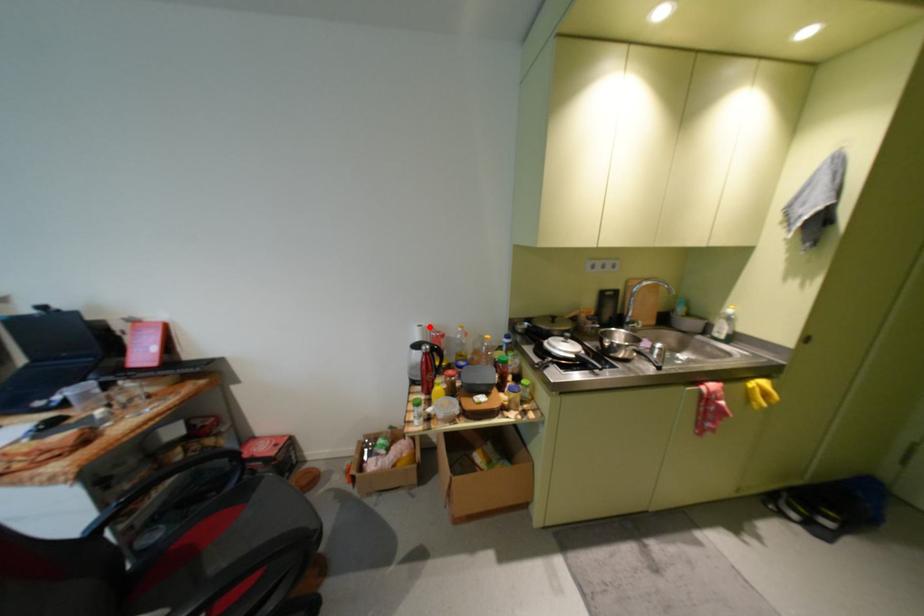
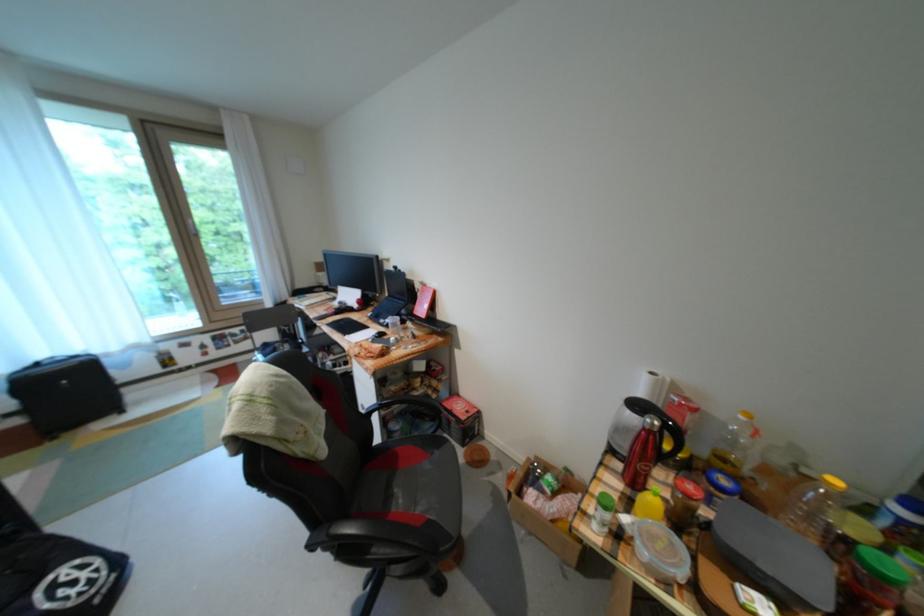
In the second image, find the point that corresponds to the highlighted location in the first image.

(662, 374)